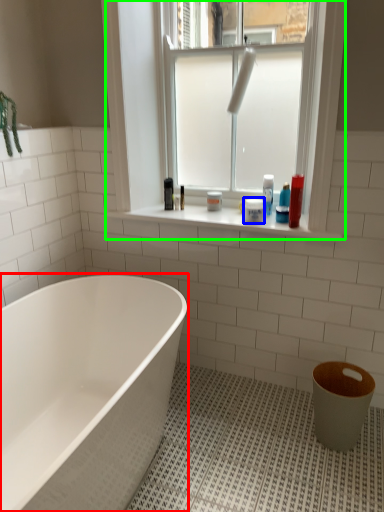
Question: Which object is the farthest from bathtub (highlighted by a red box)? Choose among these: toiletry (highlighted by a blue box) or window (highlighted by a green box).

Choices:
 (A) toiletry
 (B) window

Answer: (A)